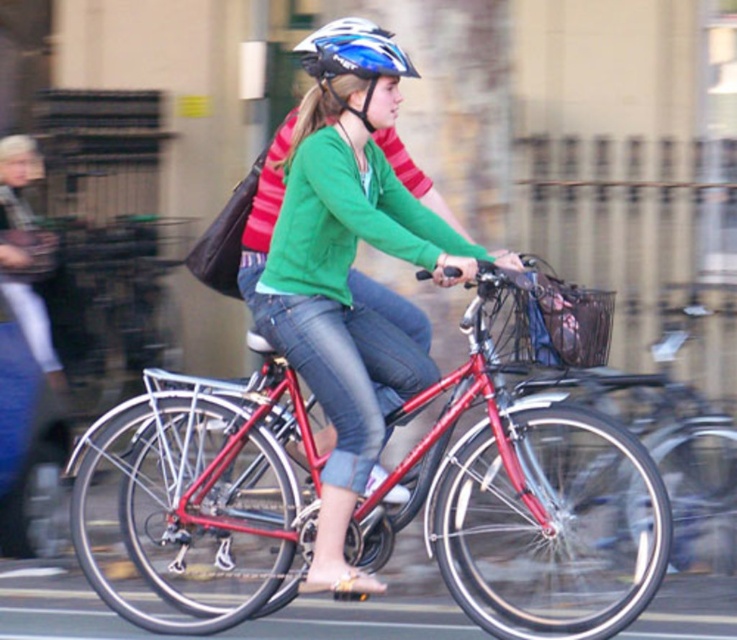
Question: Can you confirm if shiny metallic bicycle at center is smaller than blue matte helmet at upper center?

Choices:
 (A) no
 (B) yes

Answer: (A)

Question: Which of the following is the closest to the observer?

Choices:
 (A) (342, 525)
 (B) (245, 404)
 (C) (354, 22)

Answer: (A)

Question: Is shiny metallic bicycle at center below matte green sweater at center?

Choices:
 (A) yes
 (B) no

Answer: (A)

Question: Does shiny metallic bicycle at center have a smaller size compared to blue matte helmet at upper center?

Choices:
 (A) yes
 (B) no

Answer: (B)

Question: Estimate the real-world distances between objects in this image. Which object is farther from the shiny metallic bicycle at center?

Choices:
 (A) matte green sweater at center
 (B) blue matte helmet at upper center

Answer: (B)

Question: Considering the real-world distances, which object is farthest from the matte green sweater at center?

Choices:
 (A) shiny metallic bicycle at center
 (B) blue matte helmet at upper center

Answer: (A)